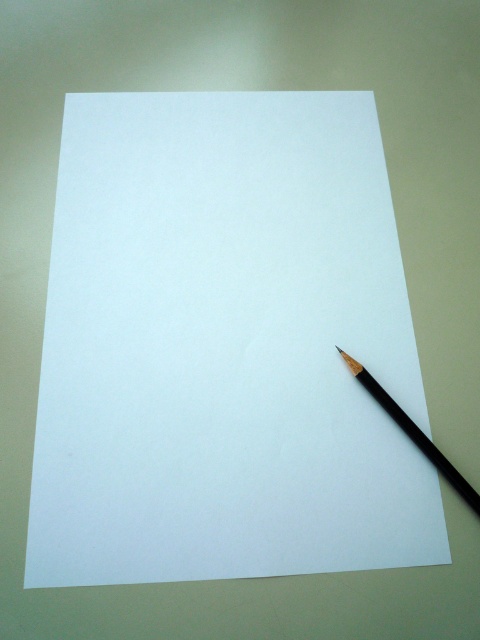
You need to write a note using the black matte pencil at lower right on the white paper at center. Can you determine if the pencil will fit entirely on the paper when placed horizontally?

The white paper at center has a larger size compared to black matte pencil at lower right, so yes, the pencil can fit entirely on the paper when placed horizontally.

Based on the photo, you are an artist who needs to place a 8 inch ruler between the white paper at center and the black matte pencil at lower right. Is there enough space to fit the ruler without overlapping either object?

The white paper at center is 7.75 inches away from the black matte pencil at lower right. Since the ruler is 8 inches long, there isn not enough space to fit it between them without overlapping either object.